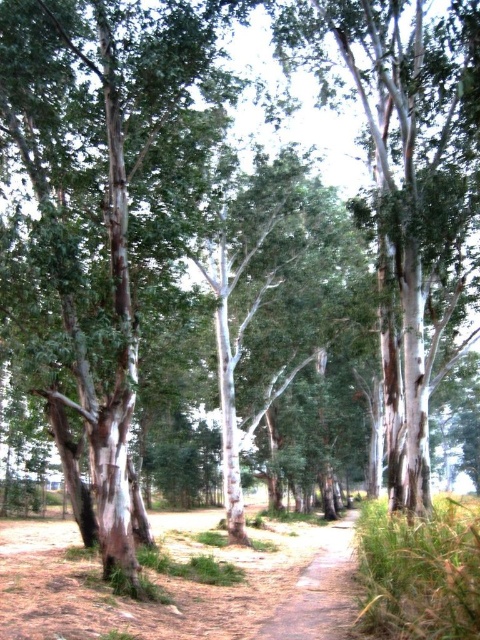
You are walking along the dirt path at center and want to reach a white bark tree at center. Which direction should you turn to head towards it?

The white bark tree at center is positioned on the right side of dirt path at center, so you should turn right to head towards it.

You are a hiker walking along the brown dirt track at center and the dirt path at center. Which one is higher in elevation?

The brown dirt track at center is much taller than dirt path at center, so the brown dirt track at center is higher in elevation.